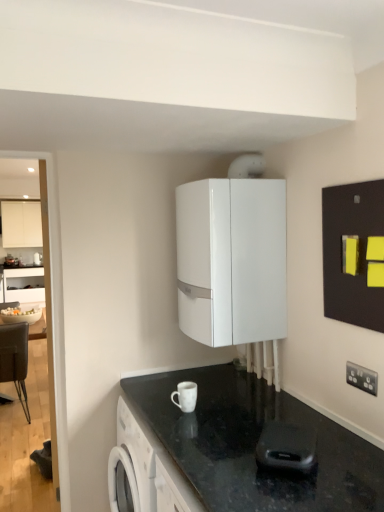
In order to click on vacant region to the left of black rubber remote control at lower center, placed as the third appliance when sorted from left to right in this screenshot , I will do `click(223, 467)`.